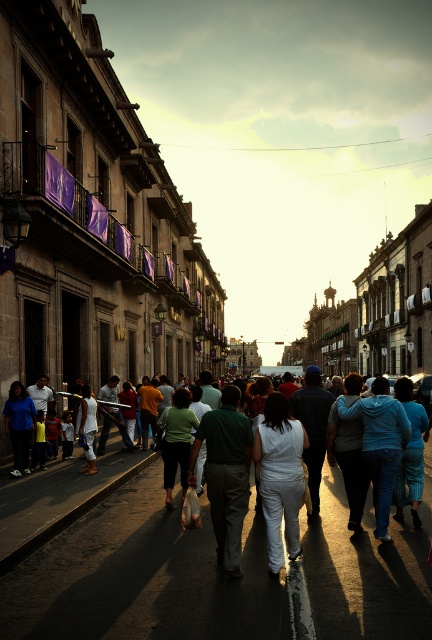
Between white cotton crowd at center and white matte pants at center, which one has less height?

white cotton crowd at center

Who is more forward, (116, 458) or (302, 444)?

Point (302, 444)

Is point (22, 497) closer to viewer compared to point (298, 422)?

No, (22, 497) is behind (298, 422).

Locate an element on the screen. This screenshot has height=640, width=432. white cotton crowd at center is located at coordinates (57, 500).